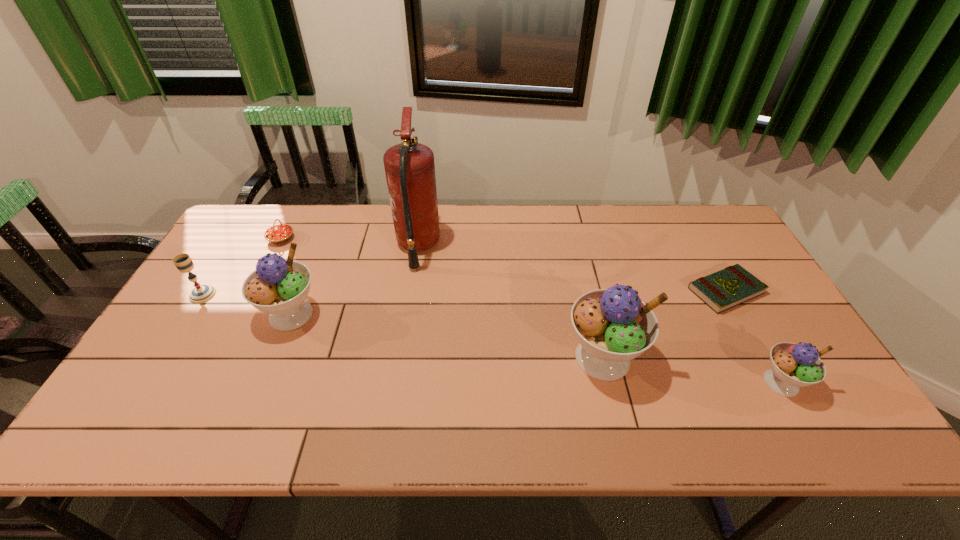
The image size is (960, 540). Identify the location of icecream that stands as the closest to the sixth tallest object. (278, 287).

Image resolution: width=960 pixels, height=540 pixels. Identify the location of the closest icecream to the chalice. point(278,287).

Identify the location of vacant position in the image that satisfies the following two spatial constraints: 1. on the front side of the chalice; 2. on the left side of the fifth object from right to left. (190, 314).

The height and width of the screenshot is (540, 960). I want to click on vacant space that satisfies the following two spatial constraints: 1. at the front of the tallest object where the nozzle is aimed; 2. on the right side of the rightmost icecream, so click(396, 382).